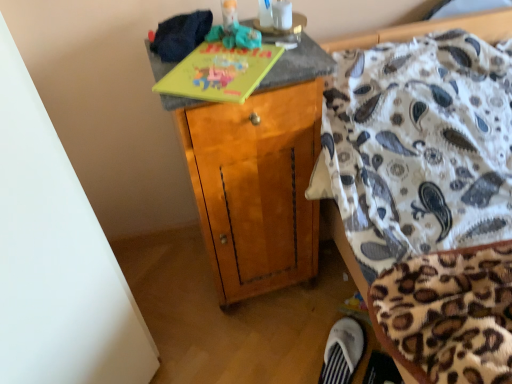
At what (x,y) coordinates should I click in order to perform the action: click on free space in front of wooden cabinet at center. Please return your answer as a coordinate pair (x, y). The height and width of the screenshot is (384, 512). Looking at the image, I should click on pyautogui.click(x=259, y=349).